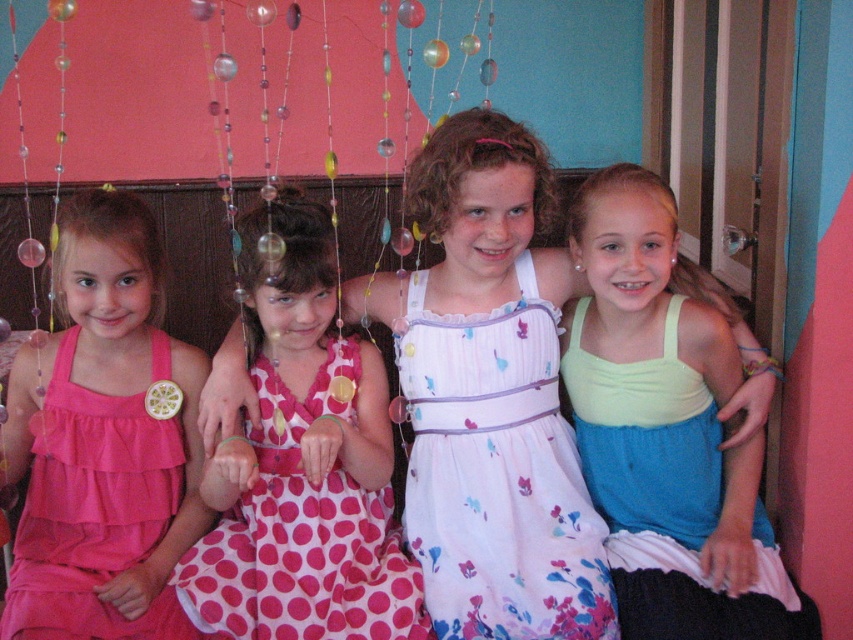
Question: Which object appears farthest from the camera in this image?

Choices:
 (A) floral cotton dress at center
 (B) pink chiffon dress at left

Answer: (A)

Question: Can you confirm if light green fabric dress at right is thinner than floral cotton dress at center?

Choices:
 (A) no
 (B) yes

Answer: (A)

Question: Among these objects, which one is nearest to the camera?

Choices:
 (A) pink chiffon dress at left
 (B) light green fabric dress at right
 (C) floral cotton dress at center
 (D) pink polka dot dress at center

Answer: (A)

Question: Estimate the real-world distances between objects in this image. Which object is farther from the floral cotton dress at center?

Choices:
 (A) pink polka dot dress at center
 (B) pink chiffon dress at left
 (C) light green fabric dress at right

Answer: (B)

Question: Is light green fabric dress at right smaller than floral cotton dress at center?

Choices:
 (A) yes
 (B) no

Answer: (B)

Question: Observing the image, what is the correct spatial positioning of floral cotton dress at center in reference to pink chiffon dress at left?

Choices:
 (A) below
 (B) above

Answer: (B)